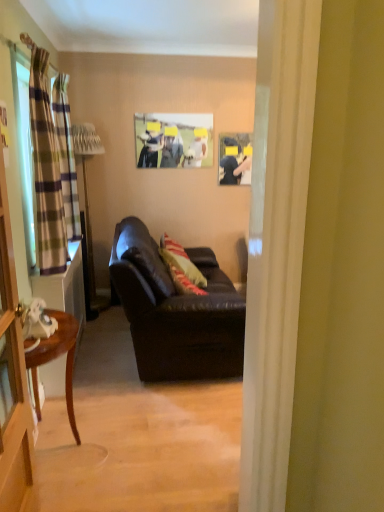
Question: From the image's perspective, is green plaid curtain at left, which is the 1th curtain in front-to-back order, located above striped fabric pillow at center?

Choices:
 (A) yes
 (B) no

Answer: (A)

Question: Does green plaid curtain at left, which is the 1th curtain in front-to-back order, have a greater height compared to striped fabric pillow at center?

Choices:
 (A) yes
 (B) no

Answer: (A)

Question: Can you confirm if green plaid curtain at left, which is the 1th curtain in front-to-back order, is positioned to the right of striped fabric pillow at center?

Choices:
 (A) no
 (B) yes

Answer: (A)

Question: Can you confirm if green plaid curtain at left, positioned as the 2th curtain in back-to-front order, is thinner than striped fabric pillow at center?

Choices:
 (A) yes
 (B) no

Answer: (A)

Question: Can you confirm if green plaid curtain at left, positioned as the 2th curtain in back-to-front order, is smaller than striped fabric pillow at center?

Choices:
 (A) no
 (B) yes

Answer: (B)

Question: From the image's perspective, is metallic silver floor lamp at left positioned above or below plaid fabric curtain at left, the second curtain in the front-to-back sequence?

Choices:
 (A) below
 (B) above

Answer: (A)

Question: Which is correct: metallic silver floor lamp at left is inside plaid fabric curtain at left, the second curtain in the front-to-back sequence, or outside of it?

Choices:
 (A) inside
 (B) outside

Answer: (B)

Question: Looking at their shapes, would you say metallic silver floor lamp at left is wider or thinner than plaid fabric curtain at left, the second curtain in the front-to-back sequence?

Choices:
 (A) thin
 (B) wide

Answer: (B)

Question: From a real-world perspective, is metallic silver floor lamp at left physically located above or below plaid fabric curtain at left, the 1th curtain viewed from the back?

Choices:
 (A) below
 (B) above

Answer: (A)

Question: Based on their positions, is clear plastic screen door at left located to the left or right of green plaid curtain at left, positioned as the 2th curtain in back-to-front order?

Choices:
 (A) right
 (B) left

Answer: (A)

Question: From a real-world perspective, is clear plastic screen door at left positioned above or below green plaid curtain at left, which is the 1th curtain in front-to-back order?

Choices:
 (A) below
 (B) above

Answer: (A)

Question: From the image's perspective, is clear plastic screen door at left above or below green plaid curtain at left, which is the 1th curtain in front-to-back order?

Choices:
 (A) below
 (B) above

Answer: (A)

Question: Is clear plastic screen door at left inside or outside of green plaid curtain at left, which is the 1th curtain in front-to-back order?

Choices:
 (A) inside
 (B) outside

Answer: (B)

Question: Is plaid fabric curtain at left, the 1th curtain viewed from the back, inside or outside of metallic silver floor lamp at left?

Choices:
 (A) outside
 (B) inside

Answer: (A)

Question: From the image's perspective, is plaid fabric curtain at left, the 1th curtain viewed from the back, above or below metallic silver floor lamp at left?

Choices:
 (A) below
 (B) above

Answer: (B)